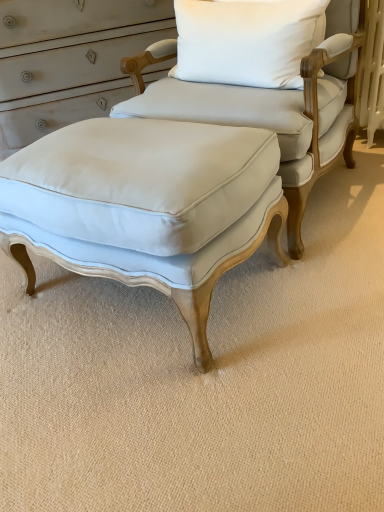
Question: Is light blue fabric ottoman at center directly adjacent to matte white fabric stool at center?

Choices:
 (A) no
 (B) yes

Answer: (A)

Question: Is light blue fabric ottoman at center positioned in front of matte white fabric stool at center?

Choices:
 (A) no
 (B) yes

Answer: (A)

Question: Considering the relative sizes of light blue fabric ottoman at center and matte white fabric stool at center in the image provided, is light blue fabric ottoman at center bigger than matte white fabric stool at center?

Choices:
 (A) yes
 (B) no

Answer: (A)

Question: From the image's perspective, is light blue fabric ottoman at center beneath matte white fabric stool at center?

Choices:
 (A) yes
 (B) no

Answer: (B)

Question: Would you say light blue fabric ottoman at center is outside matte white fabric stool at center?

Choices:
 (A) no
 (B) yes

Answer: (B)

Question: Does point (210, 3) appear closer or farther from the camera than point (314, 2)?

Choices:
 (A) closer
 (B) farther

Answer: (B)

Question: From a real-world perspective, is light blue fabric ottoman at center physically located above or below white cotton pillow at upper center?

Choices:
 (A) below
 (B) above

Answer: (A)

Question: Considering the positions of light blue fabric ottoman at center and white cotton pillow at upper center in the image, is light blue fabric ottoman at center taller or shorter than white cotton pillow at upper center?

Choices:
 (A) tall
 (B) short

Answer: (A)

Question: Considering the positions of light blue fabric ottoman at center and white cotton pillow at upper center in the image, is light blue fabric ottoman at center bigger or smaller than white cotton pillow at upper center?

Choices:
 (A) big
 (B) small

Answer: (A)

Question: Looking at the image, does light blue fabric ottoman at center seem bigger or smaller compared to matte white fabric stool at center?

Choices:
 (A) big
 (B) small

Answer: (A)

Question: From the image's perspective, is light blue fabric ottoman at center located above or below matte white fabric stool at center?

Choices:
 (A) below
 (B) above

Answer: (B)

Question: In terms of height, does light blue fabric ottoman at center look taller or shorter compared to matte white fabric stool at center?

Choices:
 (A) tall
 (B) short

Answer: (A)

Question: In the image, is light blue fabric ottoman at center positioned in front of or behind matte white fabric stool at center?

Choices:
 (A) front
 (B) behind

Answer: (B)

Question: From the image's perspective, relative to light blue fabric ottoman at center, is white cotton pillow at upper center above or below?

Choices:
 (A) above
 (B) below

Answer: (A)

Question: From a real-world perspective, is white cotton pillow at upper center physically located above or below light blue fabric ottoman at center?

Choices:
 (A) below
 (B) above

Answer: (B)